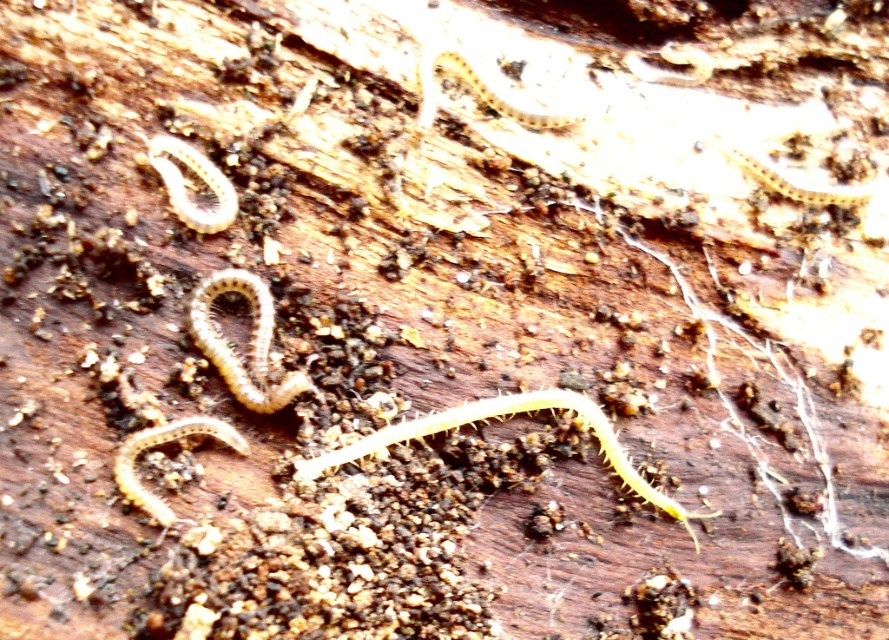
Question: Does yellowish-brown segmented centipede at center appear on the right side of yellow spiny worm at upper right?

Choices:
 (A) yes
 (B) no

Answer: (B)

Question: Which of the following is the closest to the observer?

Choices:
 (A) (715, 136)
 (B) (607, 429)

Answer: (B)

Question: Which object appears closest to the camera in this image?

Choices:
 (A) yellow spiny worm at center
 (B) translucent yellowish caterpillar at upper center
 (C) translucent yellow worm at upper left
 (D) yellowish-brown segmented centipede at center

Answer: (A)

Question: Which point is closer to the camera?

Choices:
 (A) (206, 177)
 (B) (710, 140)

Answer: (A)

Question: Can you confirm if yellow spiny worm at center is smaller than translucent yellowish caterpillar at upper center?

Choices:
 (A) yes
 (B) no

Answer: (B)

Question: Can you confirm if yellow spiny worm at center is bigger than yellowish matte caterpillar at lower left?

Choices:
 (A) yes
 (B) no

Answer: (A)